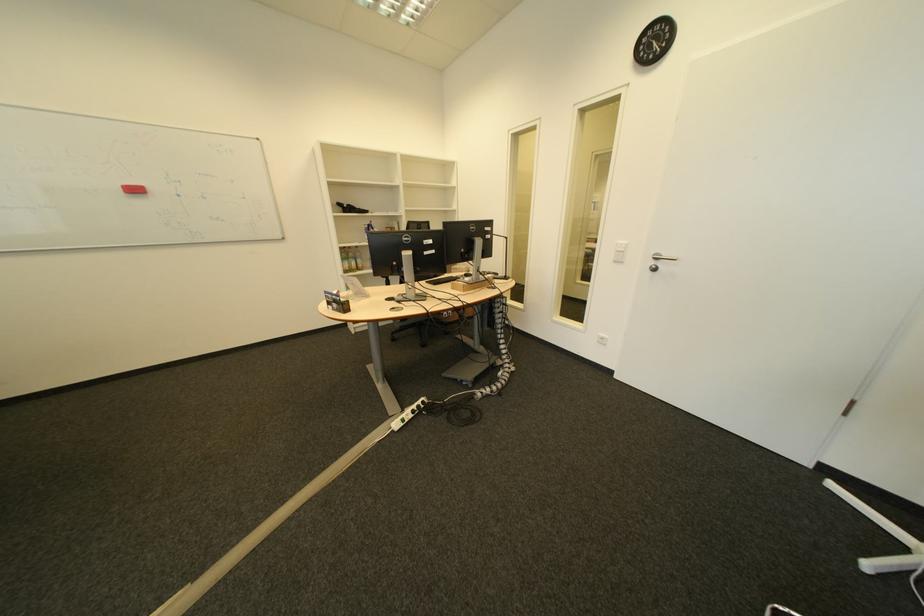
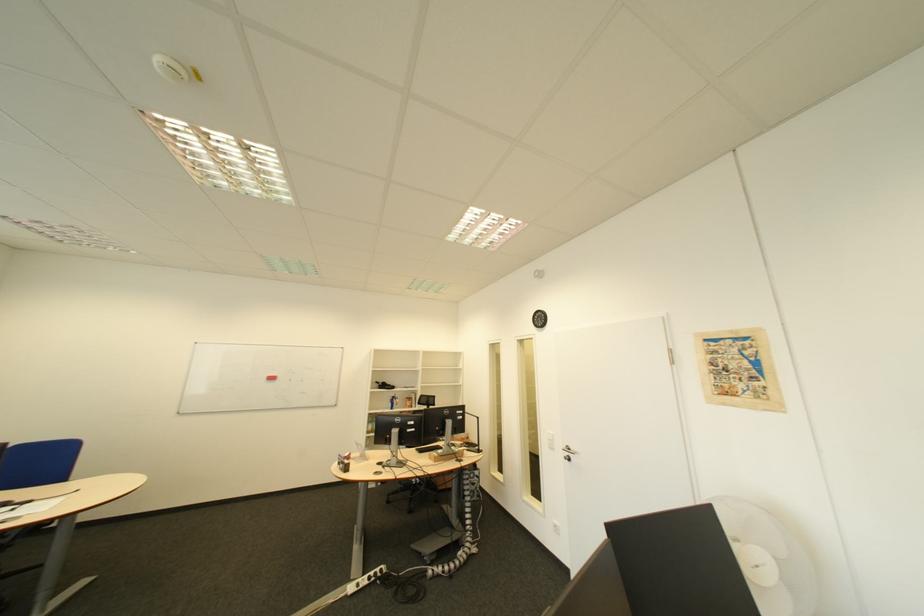
In the second image, find the point that corresponds to (636,264) in the first image.

(565, 451)